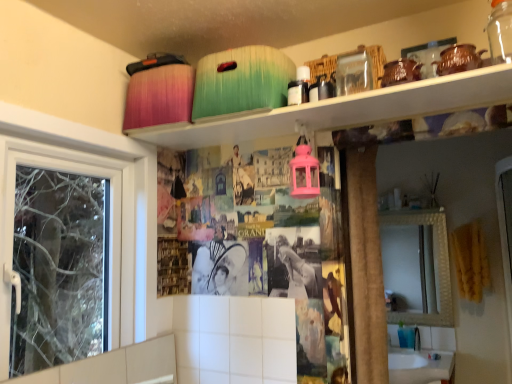
Question: From the image's perspective, is white glossy sink at lower right positioned above or below transparent glass jar at upper center?

Choices:
 (A) below
 (B) above

Answer: (A)

Question: From their relative heights in the image, would you say white glossy sink at lower right is taller or shorter than transparent glass jar at upper center?

Choices:
 (A) short
 (B) tall

Answer: (B)

Question: Estimate the real-world distances between objects in this image. Which object is farther from the white glossy sink at lower right?

Choices:
 (A) transparent glass jar at upper center
 (B) matte plastic containers at upper center

Answer: (A)

Question: Based on their relative distances, which object is nearer to the transparent glass jar at upper center?

Choices:
 (A) matte plastic containers at upper center
 (B) white glossy sink at lower right

Answer: (A)